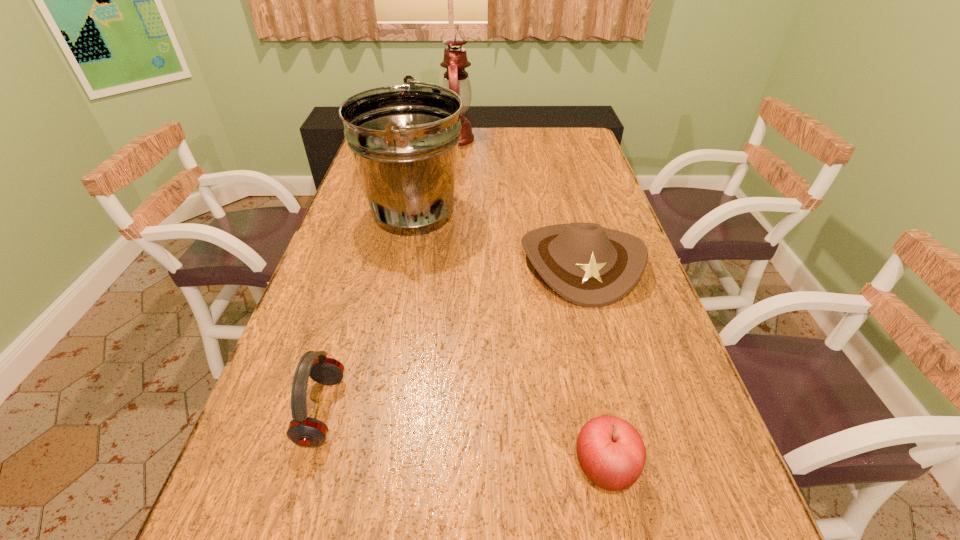
The width and height of the screenshot is (960, 540). I want to click on oil lamp, so click(x=455, y=61).

The width and height of the screenshot is (960, 540). I want to click on bucket, so click(404, 139).

Where is `earphone`? The image size is (960, 540). earphone is located at coordinates (304, 431).

What are the coordinates of `cowboy hat` in the screenshot? It's located at (589, 265).

Identify the location of apple. This screenshot has height=540, width=960. (611, 452).

This screenshot has width=960, height=540. I want to click on free spot located 0.400m on the right of the farthest object, so click(x=574, y=139).

This screenshot has width=960, height=540. Identify the location of free location located on the back of the bucket. (429, 136).

Identify the location of vacant point located on the ear cups of the earphone. (437, 410).

I want to click on free location located with a star on the front of the cowboy hat, so click(602, 343).

Where is `free location located 0.230m on the back of the apple`? This screenshot has width=960, height=540. free location located 0.230m on the back of the apple is located at coordinates (577, 342).